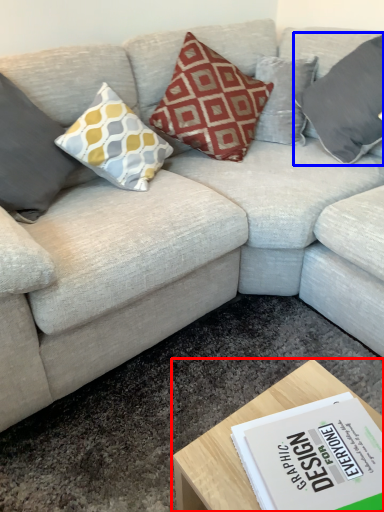
Question: Which object appears closest to the camera in this image, coffee table (highlighted by a red box) or pillow (highlighted by a blue box)?

Choices:
 (A) coffee table
 (B) pillow

Answer: (A)